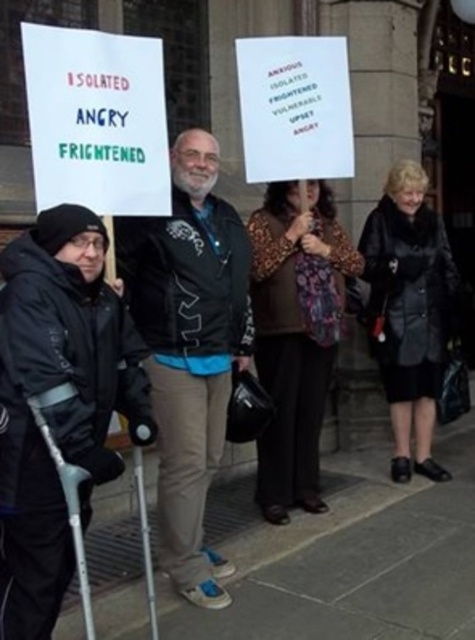
You are a photographer standing in front of the protest scene. You notice two points marked in the image. The first point is at coordinate (328, 534) and the second is at (161, 376). Which point is closer to you?

Point (328, 534) is closer to you because it is further to the viewer than point (161, 376).

You are a photographer trying to capture a closeup of the black matte jacket at center and the leopard print scarf at center in the scene. Which object should you zoom in on to ensure both are visible without moving the camera?

The leopard print scarf at center is smaller than the black matte jacket at center, so zooming in on the black matte jacket at center will allow both objects to remain visible while maintaining their relative sizes.

You are a photographer trying to capture a closeup of the leopard print scarf at center and the black matte jacket at center. Which object should you focus on first if you want to ensure both are in focus without moving the camera?

The black matte jacket at center is positioned on the left side of leopard print scarf at center, so you should focus on the black matte jacket at center first since it is closer to the camera. This way, the depth of field may cover both objects in focus.